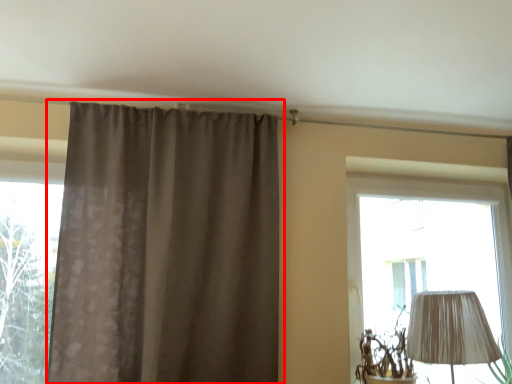
Question: From the image's perspective, what is the correct spatial positioning of curtain (annotated by the red box) in reference to window?

Choices:
 (A) above
 (B) below

Answer: (A)